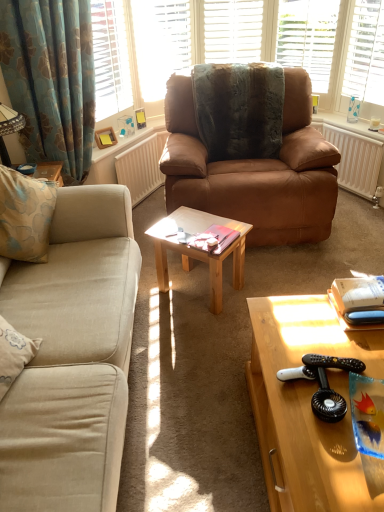
Question: Is clear glass vase at upper right, the 1th window in the right-to-left sequence, wider or thinner than blue floral fabric curtain at left?

Choices:
 (A) wide
 (B) thin

Answer: (A)

Question: From a real-world perspective, is clear glass vase at upper right, the 1th window in the right-to-left sequence, above or below blue floral fabric curtain at left?

Choices:
 (A) below
 (B) above

Answer: (B)

Question: Which is farther from the brown leather armchair at center, positioned as the 2th studio couch in front-to-back order?

Choices:
 (A) blue floral fabric curtain at left
 (B) white wood blinds at upper center, marked as the second window in a right-to-left arrangement
 (C) wooden coffee table at lower right, the 2th coffee table viewed from the left
 (D) matte pink book at center
 (E) white textured radiator at right, which appears as the first radiator when viewed from the right

Answer: (C)

Question: Estimate the real-world distances between objects in this image. Which object is closer to the clear glass vase at upper right, the 1th window in the right-to-left sequence?

Choices:
 (A) blue floral fabric curtain at left
 (B) white wood blinds at upper center, which is the third window from right to left
 (C) matte wooden picture frame at upper left
 (D) beige fabric couch at left, which ranks as the first studio couch in front-to-back order
 (E) white matte shutter at upper center

Answer: (E)